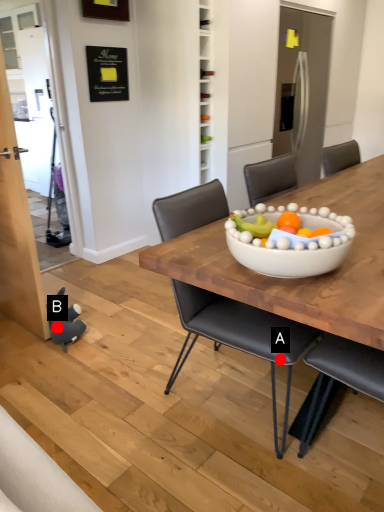
Question: Two points are circled on the image, labeled by A and B beside each circle. Which of the following is the closest to the observer?

Choices:
 (A) A is closer
 (B) B is closer

Answer: (A)